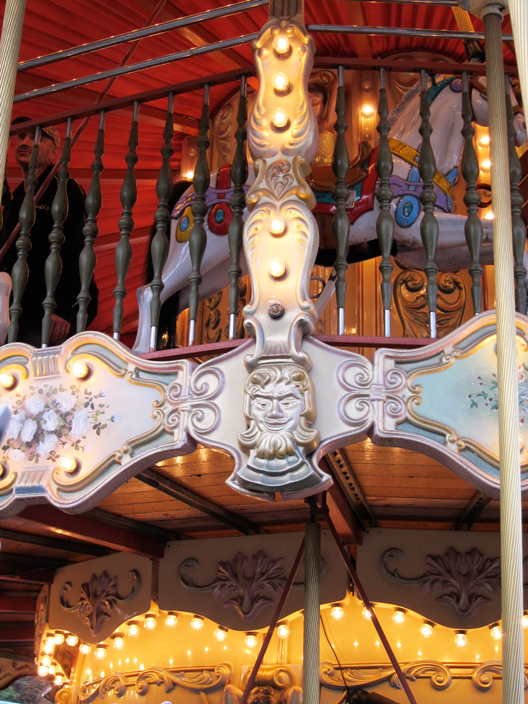
At what (x,y) coordinates should I click in order to perform the action: click on top floor railing. Please return your answer as a coordinate pair (x, y). The height and width of the screenshot is (704, 528). Looking at the image, I should click on (230, 75).